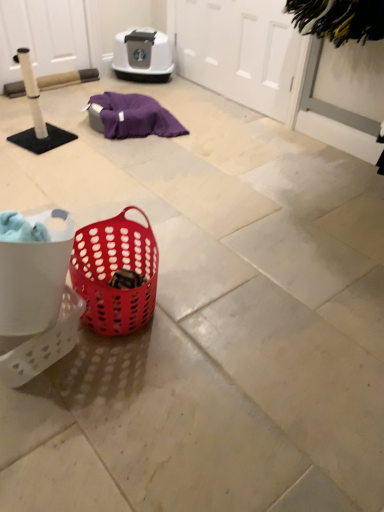
The image size is (384, 512). Find the location of `free location in front of white perforated basket at lower left`. free location in front of white perforated basket at lower left is located at coordinates click(x=51, y=429).